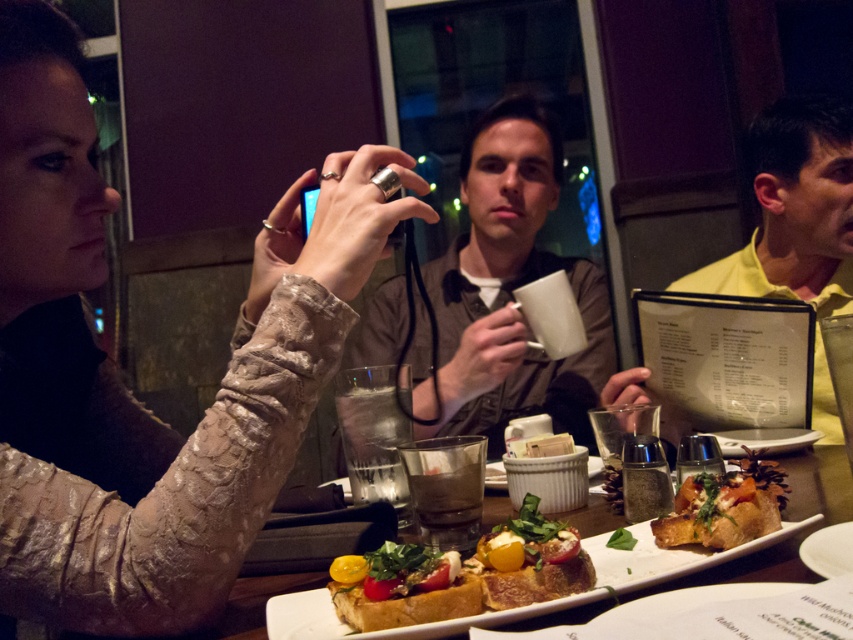
Consider the image. You are a photographer trying to capture the crusty bread with fresh toppings at center and the matte gold ring at upper center in your shot. Which object should you adjust your focus on first if you want the bread to be the main subject?

You should focus on the crusty bread with fresh toppings at center first since it is the main subject and the matte gold ring at upper center is positioned to its left side, making it a secondary element in the composition.

You are a photographer adjusting your camera settings to capture the scene. The matte gold ring at upper center is crucial for the composition. Where exactly should you position your camera to ensure the ring is centered in the frame?

To center the matte gold ring at upper center in the frame, position your camera at the coordinates corresponding to point 0.609 on the horizontal axis and 0.148 on the vertical axis.